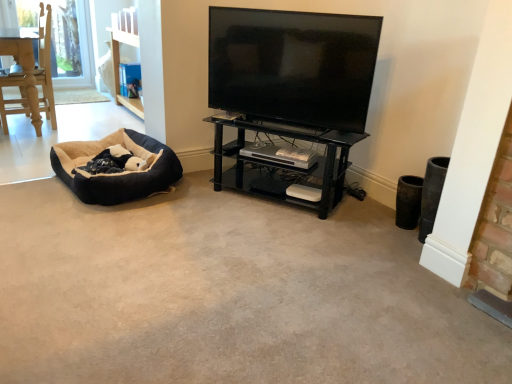
Question: In terms of width, does black glass shelf at center look wider or thinner when compared to soft suede dog bed at left?

Choices:
 (A) thin
 (B) wide

Answer: (A)

Question: Which is correct: black glass shelf at center is inside soft suede dog bed at left, or outside of it?

Choices:
 (A) inside
 (B) outside

Answer: (B)

Question: Estimate the real-world distances between objects in this image. Which object is farther from the soft suede dog bed at left?

Choices:
 (A) black glass shelf at center
 (B) black glossy tv at upper center

Answer: (B)

Question: Considering the real-world distances, which object is closest to the black glossy tv at upper center?

Choices:
 (A) black glass shelf at center
 (B) soft suede dog bed at left

Answer: (A)